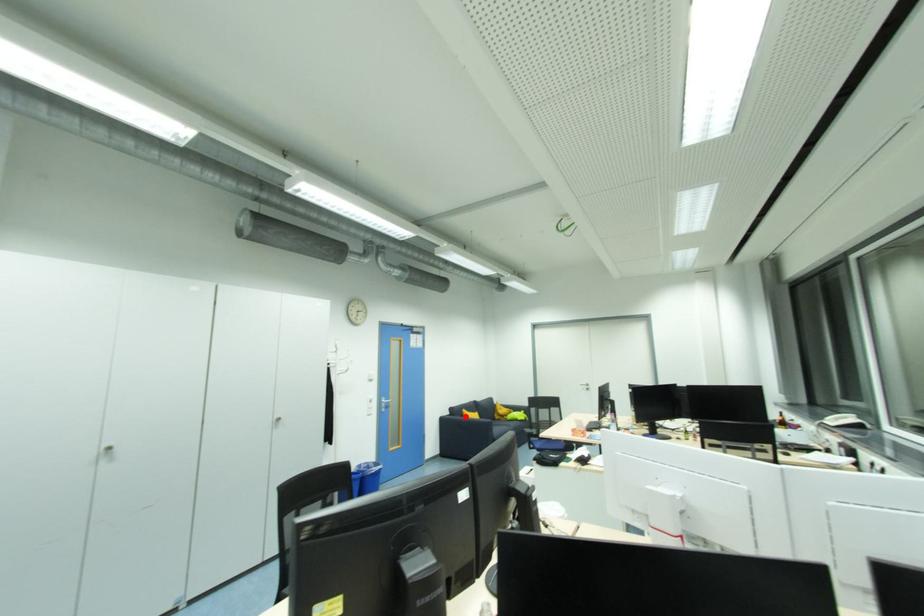
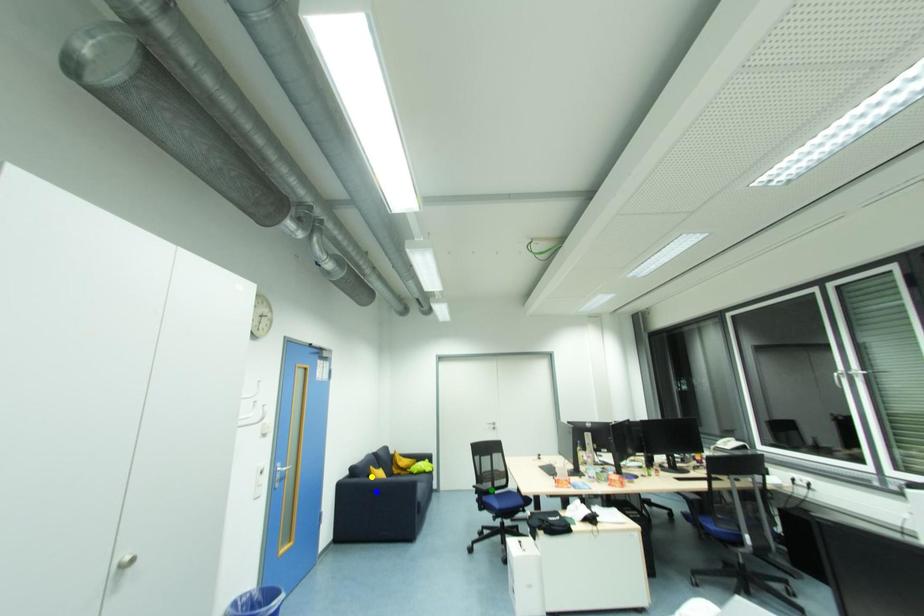
Question: I am providing you with two images of the same scene from different viewpoints. A red point is marked on the first image. You are given multiple points on the second image. Which point in image 2 represents the same 3d spot as the red point in image 1?

Choices:
 (A) green point
 (B) yellow point
 (C) blue point

Answer: (B)